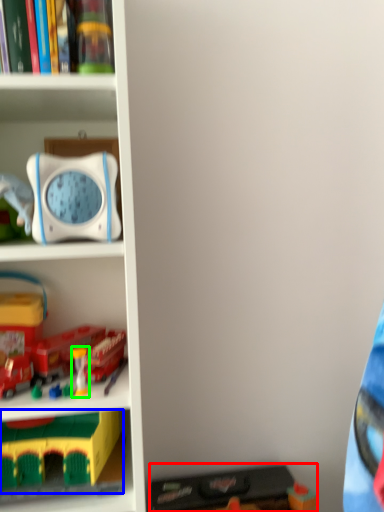
Question: Considering the real-world distances, which object is closest to toy (highlighted by a red box)? toy (highlighted by a blue box) or toy (highlighted by a green box).

Choices:
 (A) toy
 (B) toy

Answer: (A)